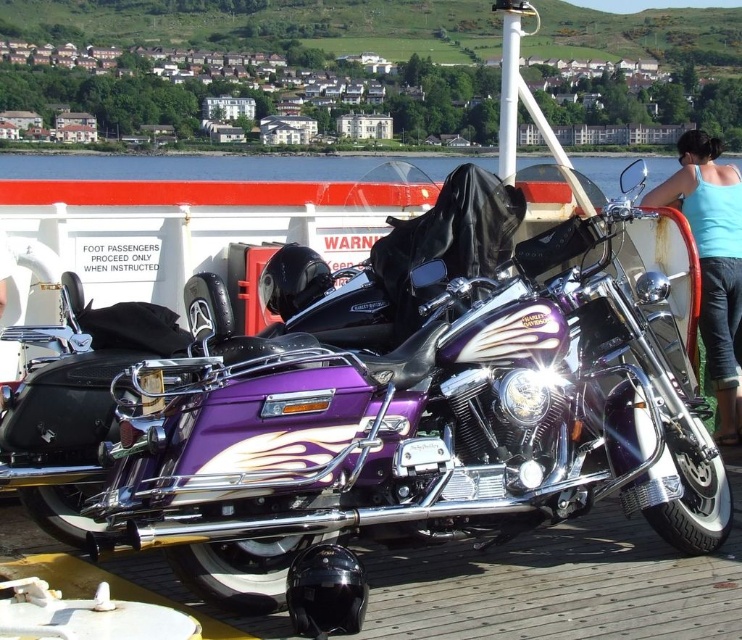
Question: Does purple glossy motorcycle at center have a lesser width compared to blue fabric tank top at upper right?

Choices:
 (A) yes
 (B) no

Answer: (B)

Question: Which object is farther from the camera taking this photo?

Choices:
 (A) blue fabric tank top at upper right
 (B) purple glossy motorcycle at center

Answer: (A)

Question: Is purple glossy motorcycle at center further to the viewer compared to blue fabric tank top at upper right?

Choices:
 (A) no
 (B) yes

Answer: (A)

Question: Does purple glossy motorcycle at center have a larger size compared to blue fabric tank top at upper right?

Choices:
 (A) yes
 (B) no

Answer: (A)